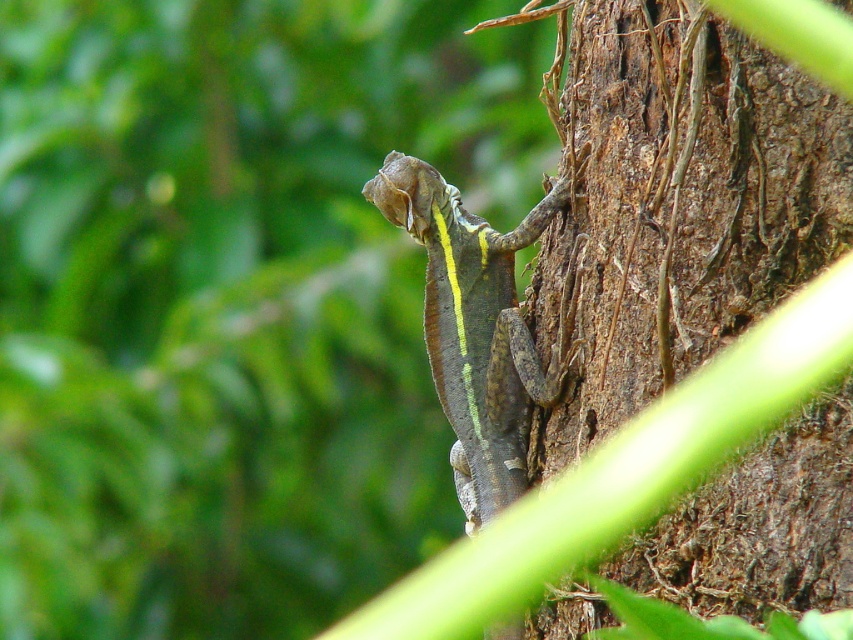
You are a photographer aiming to capture the brown rough bark at center and the shiny green scales at center in a single frame. Based on their sizes, which object should you focus on first to ensure both are in focus?

The brown rough bark at center is taller than shiny green scales at center, so focusing on the brown rough bark at center first will help ensure both are in focus as it is the larger object.

You are a biologist measuring the distance between two features in the image. You have a ruler that can measure up to 8 inches. Can you accurately measure the distance between the brown rough bark at center and the shiny green scales at center with your ruler?

The distance between the brown rough bark at center and the shiny green scales at center is 7.90 inches, which is within the ruler measurement limit of 8 inches. Therefore, the biologist can accurately measure the distance using the ruler.